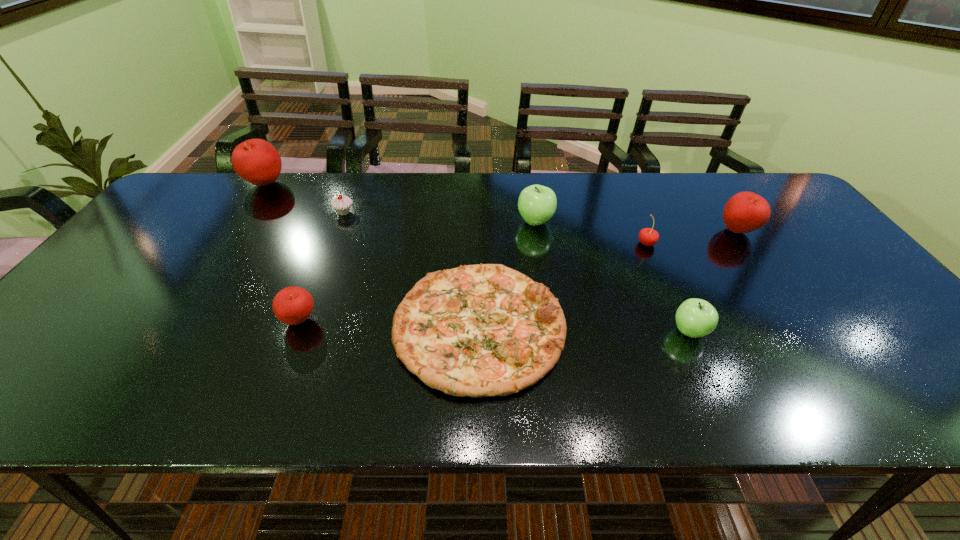
Identify the location of the tallest apple. (257, 161).

This screenshot has width=960, height=540. Find the location of `the leftmost object`. the leftmost object is located at coordinates (257, 161).

What are the coordinates of `the farther green apple` in the screenshot? It's located at (537, 204).

Locate an element on the screen. The image size is (960, 540). the left green apple is located at coordinates (537, 204).

Identify the location of the rightmost apple. (745, 212).

Find the location of a particular element. The image size is (960, 540). the rightmost object is located at coordinates (745, 212).

You are a GUI agent. You are given a task and a screenshot of the screen. Output one action in this format:
    pyautogui.click(x=<x>, y=<y>)
    Task: Click on the cupcake
    The width and height of the screenshot is (960, 540).
    Given the screenshot: What is the action you would take?
    pyautogui.click(x=342, y=204)

You are a GUI agent. You are given a task and a screenshot of the screen. Output one action in this format:
    pyautogui.click(x=<x>, y=<y>)
    Task: Click on the cherry
    
    Given the screenshot: What is the action you would take?
    pyautogui.click(x=647, y=236)

Find the location of a particular element. the right green apple is located at coordinates (695, 318).

The width and height of the screenshot is (960, 540). In order to click on the second apple from right to left in this screenshot , I will do `click(695, 318)`.